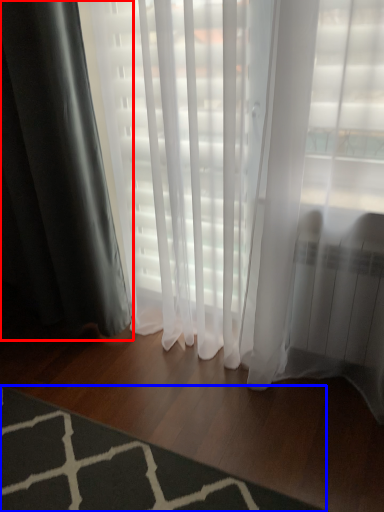
Question: Which of the following is the closest to the observer, curtain (highlighted by a red box) or mat (highlighted by a blue box)?

Choices:
 (A) curtain
 (B) mat

Answer: (B)